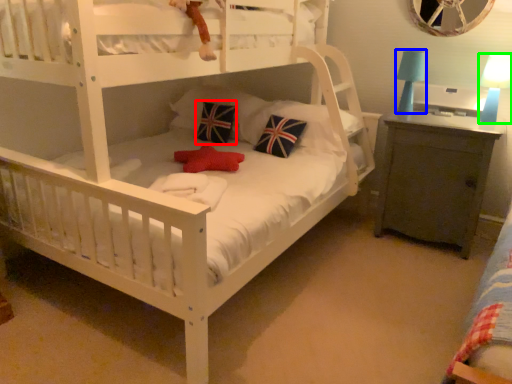
Question: Which is farther away from pillow (highlighted by a red box)? table lamp (highlighted by a blue box) or table lamp (highlighted by a green box)?

Choices:
 (A) table lamp
 (B) table lamp

Answer: (B)